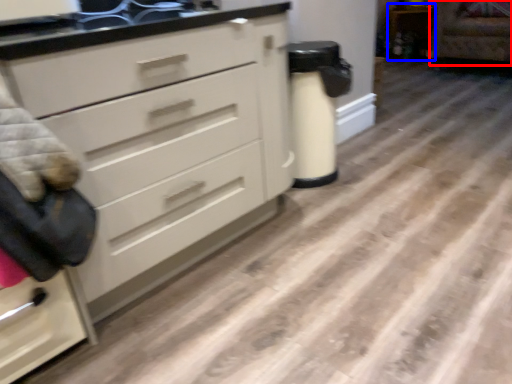
Question: Which of the following is the closest to the observer, armchair (highlighted by a red box) or cabinetry (highlighted by a blue box)?

Choices:
 (A) armchair
 (B) cabinetry

Answer: (A)